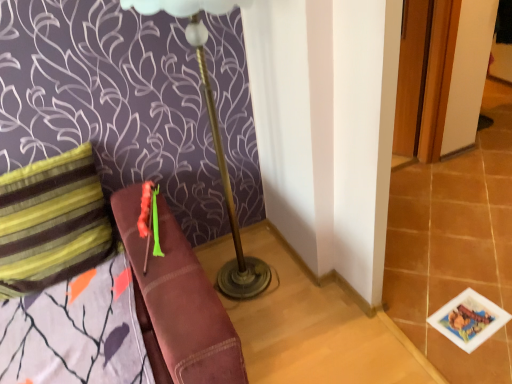
The width and height of the screenshot is (512, 384). What do you see at coordinates (51, 222) in the screenshot?
I see `striped fabric pillow at left` at bounding box center [51, 222].

Image resolution: width=512 pixels, height=384 pixels. In order to click on striped fabric pillow at left in this screenshot , I will do `click(51, 222)`.

From a real-world perspective, is metallic gold table lamp at center on top of striped fabric pillow at left?

Yes, from a real-world perspective, metallic gold table lamp at center is over striped fabric pillow at left

From the image's perspective, does metallic gold table lamp at center appear lower than striped fabric pillow at left?

No, from the image's perspective, metallic gold table lamp at center is not below striped fabric pillow at left.

Considering the relative positions of metallic gold table lamp at center and striped fabric pillow at left in the image provided, is metallic gold table lamp at center to the left or to the right of striped fabric pillow at left?

From the image, it's evident that metallic gold table lamp at center is to the right of striped fabric pillow at left.

Visually, is metallic gold table lamp at center positioned to the left or to the right of printed paper card at lower right?

In the image, metallic gold table lamp at center appears on the left side of printed paper card at lower right.

Could you tell me if metallic gold table lamp at center is turned towards printed paper card at lower right?

No.

Who is shorter, metallic gold table lamp at center or printed paper card at lower right?

printed paper card at lower right.

Is striped fabric pillow at left oriented away from metallic gold table lamp at center?

No, striped fabric pillow at left's orientation is not away from metallic gold table lamp at center.

Does striped fabric pillow at left have a lesser width compared to metallic gold table lamp at center?

Correct, the width of striped fabric pillow at left is less than that of metallic gold table lamp at center.

Can metallic gold table lamp at center be found inside striped fabric pillow at left?

No, metallic gold table lamp at center is not inside striped fabric pillow at left.

Is the depth of striped fabric pillow at left less than that of metallic gold table lamp at center?

No, striped fabric pillow at left is further to the viewer.

Who is more distant, striped fabric pillow at left or printed paper card at lower right?

printed paper card at lower right is behind.

Can you confirm if striped fabric pillow at left is positioned to the right of printed paper card at lower right?

No, striped fabric pillow at left is not to the right of printed paper card at lower right.

Which is closer to the camera, (x=42, y=244) or (x=488, y=308)?

Point (x=42, y=244) is closer to the camera than point (x=488, y=308).

What's the angular difference between striped fabric pillow at left and printed paper card at lower right's facing directions?

The facing directions of striped fabric pillow at left and printed paper card at lower right are 98.1 degrees apart.

Visually, is printed paper card at lower right positioned to the left or to the right of striped fabric pillow at left?

printed paper card at lower right is positioned on striped fabric pillow at left's right side.

Is printed paper card at lower right touching striped fabric pillow at left?

No, printed paper card at lower right is not touching striped fabric pillow at left.

The height and width of the screenshot is (384, 512). In order to click on pillow that is above the printed paper card at lower right (from a real-world perspective) in this screenshot , I will do `click(51, 222)`.

Is point (475, 310) positioned before point (56, 201)?

No.

Is printed paper card at lower right positioned far away from metallic gold table lamp at center?

Actually, printed paper card at lower right and metallic gold table lamp at center are a little close together.

From a real-world perspective, is printed paper card at lower right physically located above or below metallic gold table lamp at center?

In terms of real-world spatial position, printed paper card at lower right is below metallic gold table lamp at center.

Is metallic gold table lamp at center surrounded by printed paper card at lower right?

That's incorrect, metallic gold table lamp at center is not inside printed paper card at lower right.

Does point (479, 331) come closer to viewer compared to point (226, 268)?

Yes.

Where is `pillow behind the metallic gold table lamp at center`? The height and width of the screenshot is (384, 512). pillow behind the metallic gold table lamp at center is located at coordinates (51, 222).

You are a GUI agent. You are given a task and a screenshot of the screen. Output one action in this format:
    pyautogui.click(x=<x>, y=<y>)
    Task: Click on the card game lying below the metallic gold table lamp at center (from the image's perspective)
    Image resolution: width=512 pixels, height=384 pixels.
    Given the screenshot: What is the action you would take?
    pyautogui.click(x=469, y=320)

In the scene shown: Estimate the real-world distances between objects in this image. Which object is closer to striped fabric pillow at left, printed paper card at lower right or metallic gold table lamp at center?

The object closer to striped fabric pillow at left is metallic gold table lamp at center.

Considering their positions, is printed paper card at lower right positioned further to metallic gold table lamp at center than striped fabric pillow at left?

printed paper card at lower right is further to metallic gold table lamp at center.

Considering their positions, is metallic gold table lamp at center positioned further to printed paper card at lower right than striped fabric pillow at left?

The object further to printed paper card at lower right is striped fabric pillow at left.

When comparing their distances from metallic gold table lamp at center, does striped fabric pillow at left or printed paper card at lower right seem further?

printed paper card at lower right.

Which object lies nearer to the anchor point printed paper card at lower right, striped fabric pillow at left or metallic gold table lamp at center?

metallic gold table lamp at center lies closer to printed paper card at lower right than the other object.

From the image, which object appears to be farther from striped fabric pillow at left, metallic gold table lamp at center or printed paper card at lower right?

printed paper card at lower right lies further to striped fabric pillow at left than the other object.

Locate an element on the screen. table lamp between striped fabric pillow at left and printed paper card at lower right is located at coordinates (215, 141).